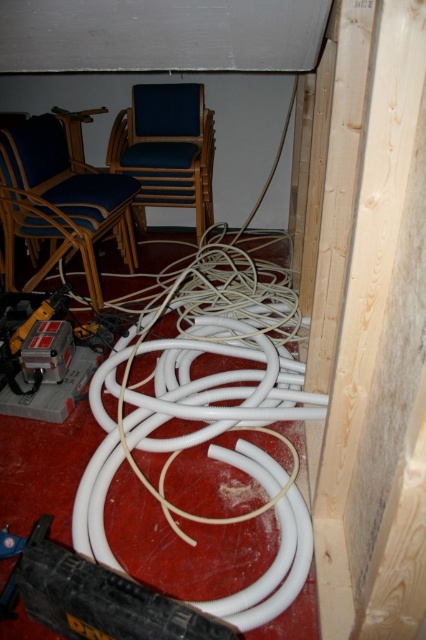
Question: Is blue fabric chair at center to the right of yellow plastic drill at lower left from the viewer's perspective?

Choices:
 (A) no
 (B) yes

Answer: (B)

Question: Based on their relative distances, which object is nearer to the blue fabric chair at center?

Choices:
 (A) yellow plastic drill at lower left
 (B) matte blue wood chair at upper left

Answer: (B)

Question: Which is farther from the matte blue wood chair at upper left?

Choices:
 (A) blue fabric chair at center
 (B) yellow plastic drill at lower left

Answer: (B)

Question: Is matte blue wood chair at upper left positioned behind blue fabric chair at center?

Choices:
 (A) no
 (B) yes

Answer: (A)

Question: Can you confirm if blue fabric chair at center is wider than yellow plastic drill at lower left?

Choices:
 (A) yes
 (B) no

Answer: (A)

Question: Which of the following is the farthest from the observer?

Choices:
 (A) (23, 145)
 (B) (13, 344)
 (C) (201, 131)

Answer: (C)